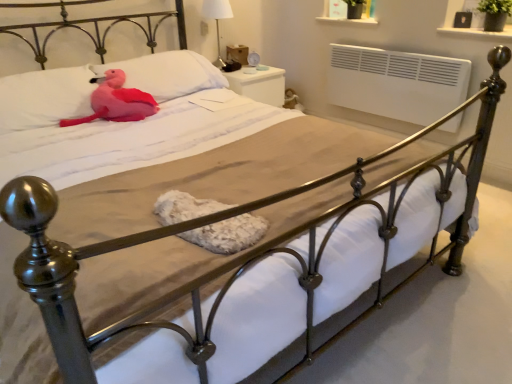
Question: In terms of height, does pink plush toy at upper left look taller or shorter compared to white fabric lampshade at upper center?

Choices:
 (A) short
 (B) tall

Answer: (A)

Question: Is pink plush toy at upper left to the left or to the right of white fabric lampshade at upper center in the image?

Choices:
 (A) left
 (B) right

Answer: (A)

Question: Which object is the closest to the pink plush toy at upper left?

Choices:
 (A) pink plush at upper left, which appears as the 1th pillow when viewed from the left
 (B) white glossy nightstand at upper right
 (C) white fabric lampshade at upper center
 (D) matte pink pillow at upper left, which is the 1th pillow from right to left

Answer: (A)

Question: Which of these objects is positioned farthest from the pink plush toy at upper left?

Choices:
 (A) white glossy nightstand at upper right
 (B) pink plush at upper left, which appears as the 1th pillow when viewed from the left
 (C) matte pink pillow at upper left, which is the 1th pillow from right to left
 (D) white fabric lampshade at upper center

Answer: (D)